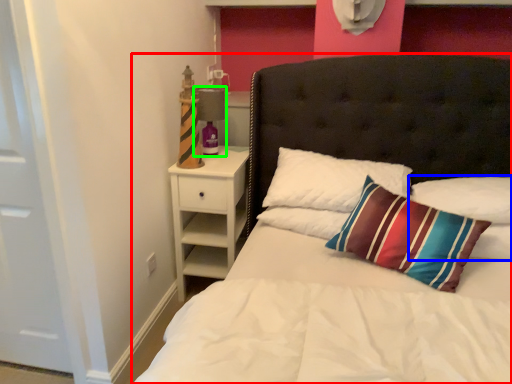
Question: Considering the real-world distances, which object is farthest from bed (highlighted by a red box)? pillow (highlighted by a blue box) or lamp (highlighted by a green box)?

Choices:
 (A) pillow
 (B) lamp

Answer: (B)